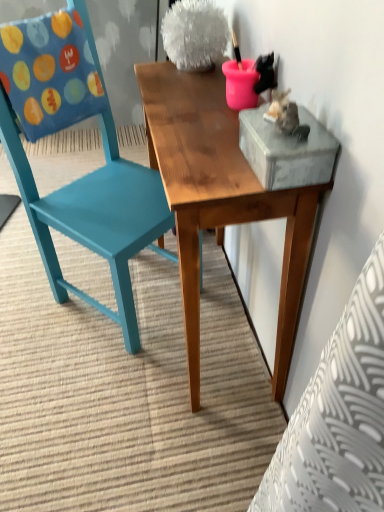
Question: Is wooden table at center spatially inside teal painted wood chair at left, or outside of it?

Choices:
 (A) inside
 (B) outside

Answer: (B)

Question: In terms of height, does wooden table at center look taller or shorter compared to teal painted wood chair at left?

Choices:
 (A) short
 (B) tall

Answer: (A)

Question: Considering the relative positions of wooden table at center and teal painted wood chair at left in the image provided, is wooden table at center to the left or to the right of teal painted wood chair at left?

Choices:
 (A) right
 (B) left

Answer: (A)

Question: From the image's perspective, is teal painted wood chair at left above or below wooden table at center?

Choices:
 (A) below
 (B) above

Answer: (B)

Question: From a real-world perspective, is teal painted wood chair at left physically located above or below wooden table at center?

Choices:
 (A) below
 (B) above

Answer: (B)

Question: Relative to wooden table at center, is teal painted wood chair at left in front or behind?

Choices:
 (A) behind
 (B) front

Answer: (A)

Question: In terms of size, does teal painted wood chair at left appear bigger or smaller than wooden table at center?

Choices:
 (A) big
 (B) small

Answer: (A)